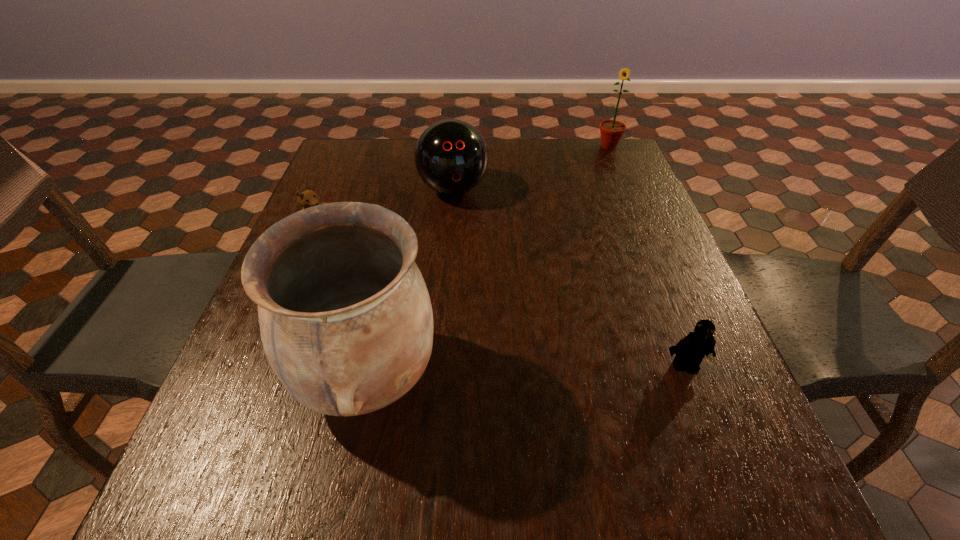
Locate an element on the screen. This screenshot has width=960, height=540. vacant point located 0.240m on the surface of the bowling ball near the finger holes is located at coordinates (473, 274).

Identify the location of vacant space located on the surface of the bowling ball near the finger holes. The height and width of the screenshot is (540, 960). (467, 247).

Find the location of `free location located 0.060m on the surface of the bowling ball near the finger holes`. free location located 0.060m on the surface of the bowling ball near the finger holes is located at coordinates (462, 224).

What are the coordinates of `vacant space situated 0.060m on the front-facing side of the third farthest object` in the screenshot? It's located at (351, 249).

Image resolution: width=960 pixels, height=540 pixels. I want to click on free space located on the front-facing side of the third farthest object, so click(428, 294).

Locate an element on the screen. This screenshot has height=540, width=960. free space located on the front-facing side of the third farthest object is located at coordinates (414, 286).

At what (x,y) coordinates should I click in order to perform the action: click on vacant space located 0.150m on the face of the second tallest object. Please return your answer as a coordinate pair (x, y). The image size is (960, 540). Looking at the image, I should click on (600, 178).

This screenshot has height=540, width=960. In order to click on vacant region located on the face of the second tallest object in this screenshot , I will do `click(587, 223)`.

In order to click on free region located 0.150m on the face of the second tallest object in this screenshot , I will do [x=600, y=178].

Identify the location of bowling ball that is at the far edge. (451, 156).